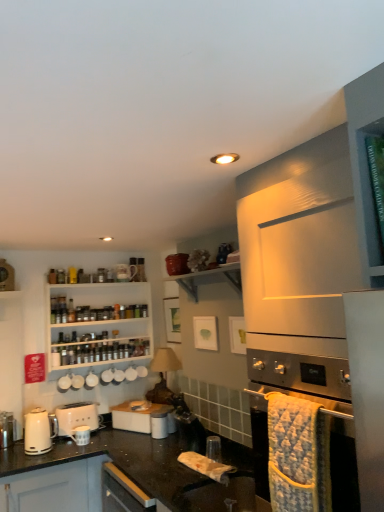
Question: Considering the relative sizes of white matte toaster at lower left, which is the 1th kitchen appliance from back to front, and stainless steel oven at lower right in the image provided, is white matte toaster at lower left, which is the 1th kitchen appliance from back to front, wider than stainless steel oven at lower right?

Choices:
 (A) no
 (B) yes

Answer: (A)

Question: Is white matte toaster at lower left, which is the 2th kitchen appliance from front to back, positioned behind stainless steel oven at lower right?

Choices:
 (A) no
 (B) yes

Answer: (B)

Question: From a real-world perspective, is white matte toaster at lower left, which is the 1th kitchen appliance from back to front, on stainless steel oven at lower right?

Choices:
 (A) no
 (B) yes

Answer: (A)

Question: Considering the relative positions of white matte toaster at lower left, which is the 1th kitchen appliance from back to front, and stainless steel oven at lower right in the image provided, is white matte toaster at lower left, which is the 1th kitchen appliance from back to front, to the left of stainless steel oven at lower right from the viewer's perspective?

Choices:
 (A) no
 (B) yes

Answer: (B)

Question: Is white matte toaster at lower left, which is the 2th kitchen appliance from front to back, bigger than stainless steel oven at lower right?

Choices:
 (A) yes
 (B) no

Answer: (B)

Question: Is white glossy electric kettle at lower left, placed as the 1th kitchen appliance when sorted from front to back, bigger or smaller than stainless steel oven at lower right?

Choices:
 (A) small
 (B) big

Answer: (A)

Question: Relative to stainless steel oven at lower right, is white glossy electric kettle at lower left, placed as the 1th kitchen appliance when sorted from front to back, in front or behind?

Choices:
 (A) behind
 (B) front

Answer: (A)

Question: Is point (31, 415) closer or farther from the camera than point (264, 378)?

Choices:
 (A) farther
 (B) closer

Answer: (A)

Question: Based on their positions, is white glossy electric kettle at lower left, placed as the 1th kitchen appliance when sorted from front to back, located to the left or right of stainless steel oven at lower right?

Choices:
 (A) right
 (B) left

Answer: (B)

Question: Is white glossy shelf at upper center wider or thinner than white matte toaster at lower left, which is the 2th kitchen appliance from front to back?

Choices:
 (A) thin
 (B) wide

Answer: (B)

Question: From their relative heights in the image, would you say white glossy shelf at upper center is taller or shorter than white matte toaster at lower left, which is the 2th kitchen appliance from front to back?

Choices:
 (A) short
 (B) tall

Answer: (A)

Question: Considering their positions, is white glossy shelf at upper center located in front of or behind white matte toaster at lower left, which is the 2th kitchen appliance from front to back?

Choices:
 (A) behind
 (B) front

Answer: (B)

Question: From the image's perspective, is white glossy shelf at upper center above or below white matte toaster at lower left, which is the 1th kitchen appliance from back to front?

Choices:
 (A) below
 (B) above

Answer: (B)

Question: Considering the positions of stainless steel oven at lower right and white glossy toaster at center in the image, is stainless steel oven at lower right bigger or smaller than white glossy toaster at center?

Choices:
 (A) big
 (B) small

Answer: (A)

Question: In the image, is stainless steel oven at lower right positioned in front of or behind white glossy toaster at center?

Choices:
 (A) front
 (B) behind

Answer: (A)